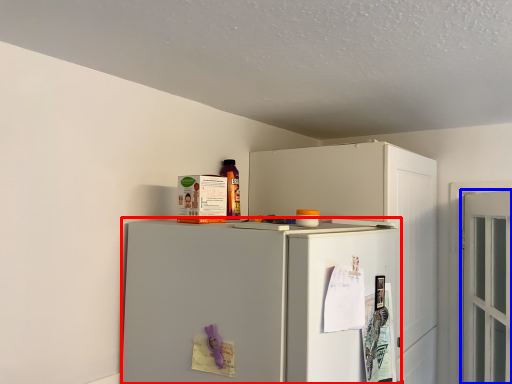
Question: Among these objects, which one is nearest to the camera, refrigerator (highlighted by a red box) or door (highlighted by a blue box)?

Choices:
 (A) refrigerator
 (B) door

Answer: (A)